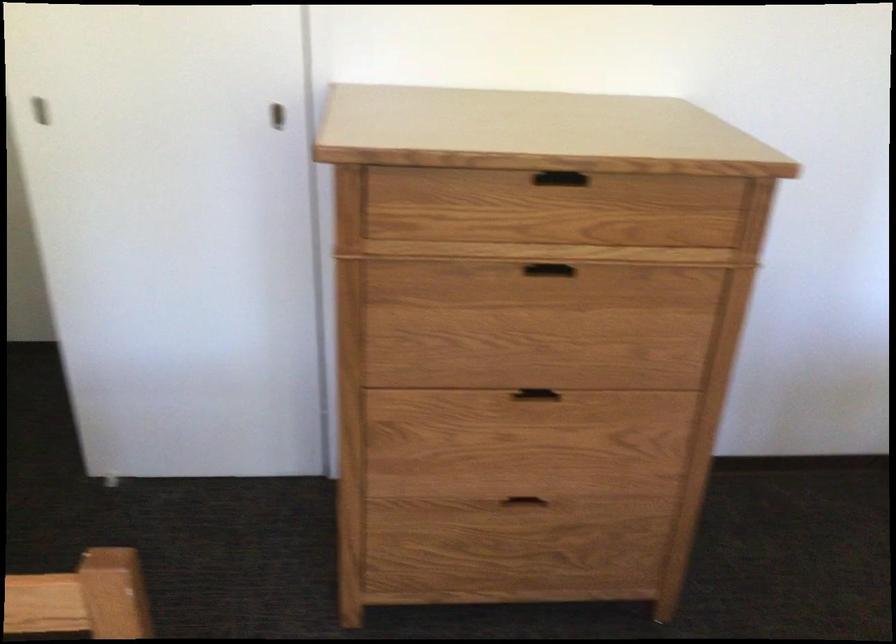
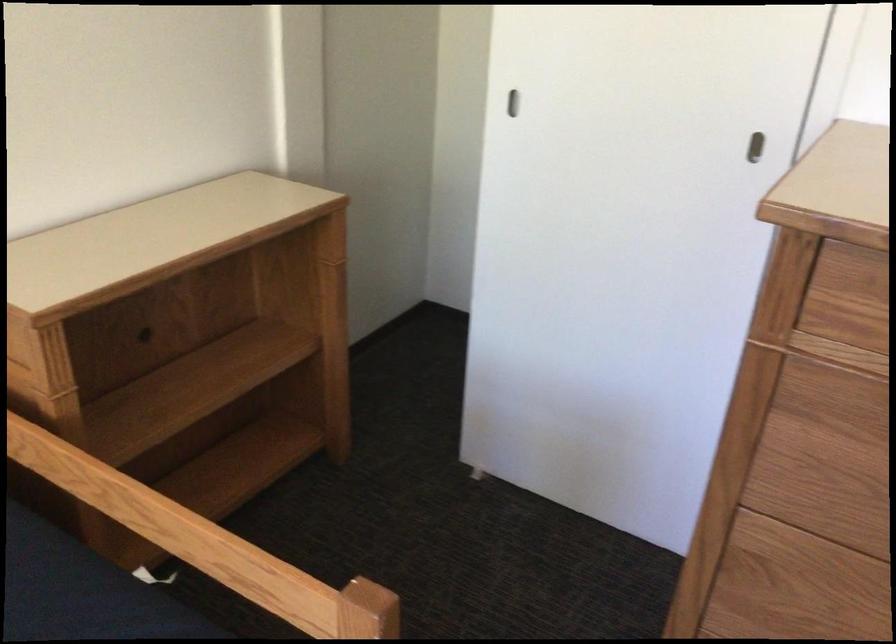
Locate, in the second image, the point that corresponds to the point at 280,120 in the first image.

(754, 147)